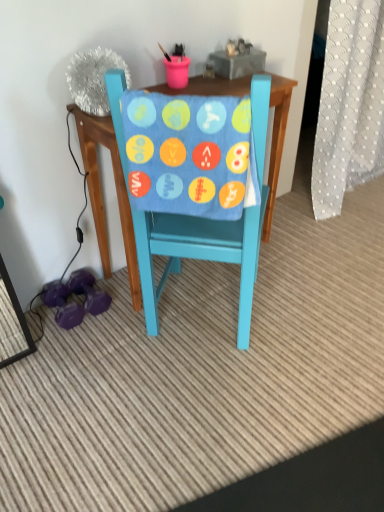
The height and width of the screenshot is (512, 384). What are the coordinates of `vacant point to the right of teal painted wood chair at center` in the screenshot? It's located at (309, 309).